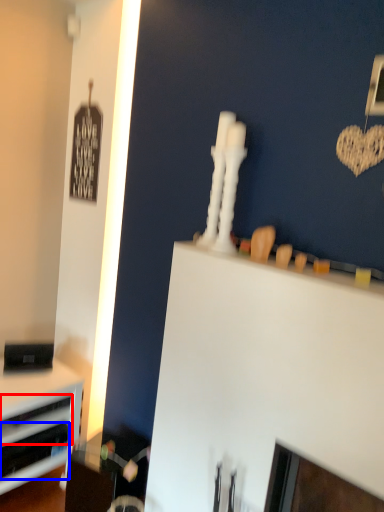
Question: Which point is further to the camera, drawer (highlighted by a red box) or drawer (highlighted by a blue box)?

Choices:
 (A) drawer
 (B) drawer

Answer: (A)